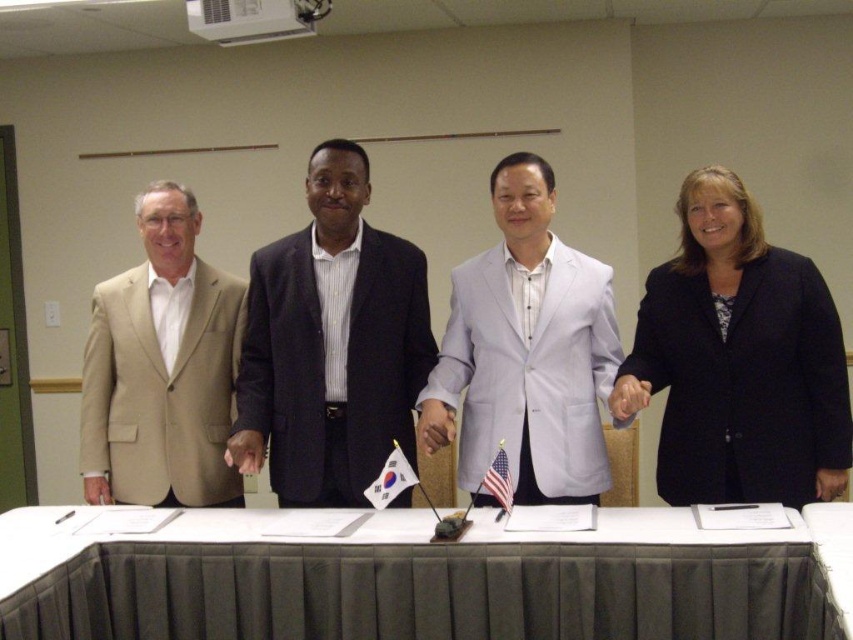
You are a photographer positioned at the back of the room and need to take a clear photo of both the tan fabric suit at left and the white fabric flag at center. Which object will appear closer to the camera in the photo?

The tan fabric suit at left will appear closer to the camera because it is further to the viewer than the white fabric flag at center, meaning it is nearer to the photographer.

You are attending a formal event and need to approach the table where the black matte blazer at right and the dark blue suit at center are located. Which person should you approach first based on their proximity to you?

You should approach the black matte blazer at right first because it is closer to you than the dark blue suit at center.

You are a photographer positioned behind the table in the scene. You need to capture a photo that includes both the tan fabric suit at left and the white fabric flag at center. Which object should you adjust your camera angle to focus on first to ensure both are in frame?

The tan fabric suit at left is wider than the white fabric flag at center, so you should focus on the tan fabric suit at left first to ensure its entire width is captured before adjusting for the smaller white fabric flag at center.